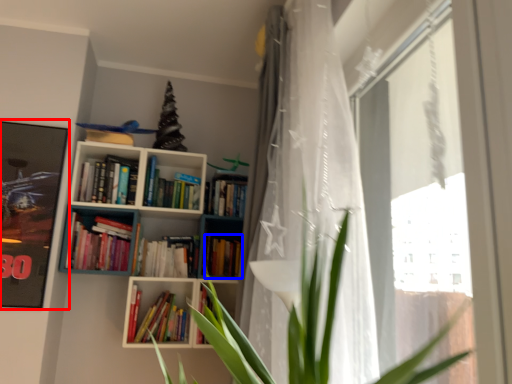
Question: Which object is closer to the camera taking this photo, picture frame (highlighted by a red box) or book (highlighted by a blue box)?

Choices:
 (A) picture frame
 (B) book

Answer: (A)